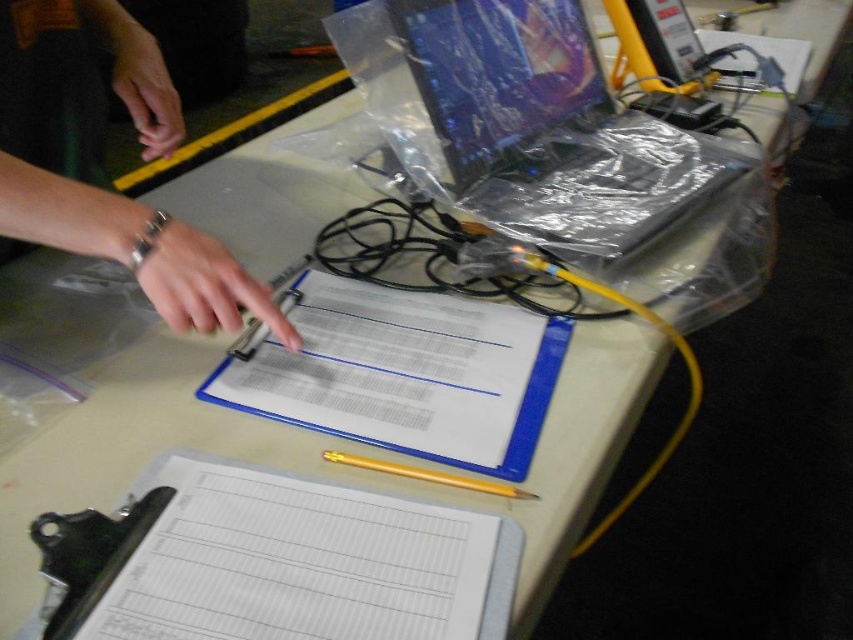
You are organizing a meeting and need to place a 12cm wide name tag on the table. The name tag must be placed on either the white paper at lower left or the smooth beige hand at center. Based on their sizes, which object can accommodate the name tag without overlapping?

The white paper at lower left can accommodate the name tag since its width is larger than the smooth beige hand at center.

Consider the image. You are organizing the items on the table and need to place a new item between the clear plastic laptop at upper right and the silver metallic bracelet at upper left. Based on their current positions, where should you position the new item?

The new item should be placed between the clear plastic laptop at upper right and the silver metallic bracelet at upper left, as the clear plastic laptop is on the right side of the silver metallic bracelet.

Based on the photo, you are trying to reach the white paper at lower left on the table but there is a laptop in the way. Can you move the laptop to access it? Explain your reasoning.

The white paper at lower left is 16.64 inches away from the viewer. Since the laptop is partially covering it and blocking access, moving the laptop would allow you to reach the white paper at lower left.